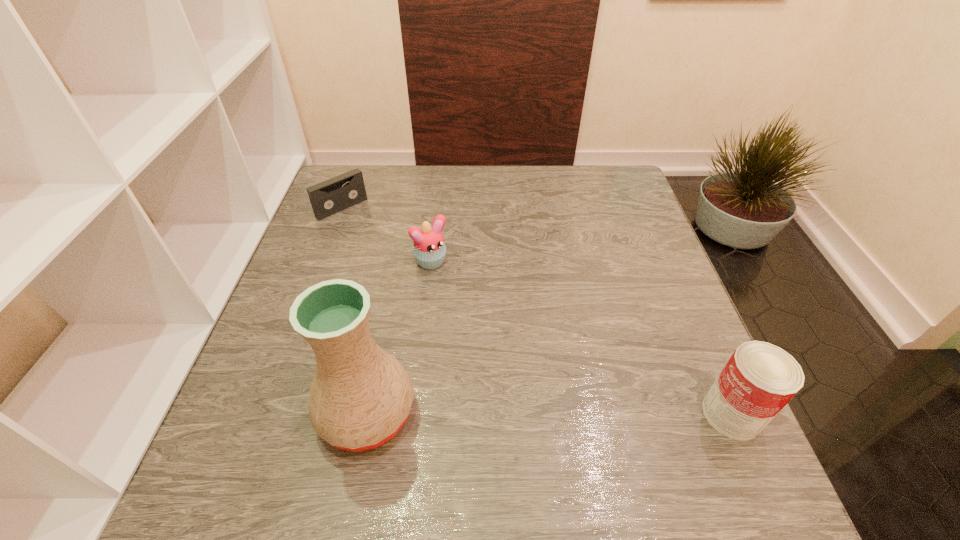
At what (x,y) coordinates should I click in order to perform the action: click on blank space located on the face of the cupcake. Please return your answer as a coordinate pair (x, y). The width and height of the screenshot is (960, 540). Looking at the image, I should click on (529, 367).

You are a GUI agent. You are given a task and a screenshot of the screen. Output one action in this format:
    pyautogui.click(x=<x>, y=<y>)
    Task: Click on the vacant space positioned 0.290m on the front-facing side of the videotape
    This screenshot has width=960, height=540.
    Given the screenshot: What is the action you would take?
    pyautogui.click(x=415, y=273)

This screenshot has height=540, width=960. I want to click on free space located 0.200m on the front-facing side of the videotape, so click(x=394, y=254).

Find the location of a particular element. The width and height of the screenshot is (960, 540). vacant area situated on the front-facing side of the videotape is located at coordinates (443, 299).

At what (x,y) coordinates should I click in order to perform the action: click on object positioned at the far edge. Please return your answer as a coordinate pair (x, y). Looking at the image, I should click on (329, 197).

The height and width of the screenshot is (540, 960). What are the coordinates of `pottery located in the near edge section of the desktop` in the screenshot? It's located at (360, 397).

Find the location of a particular element. The height and width of the screenshot is (540, 960). can that is at the near edge is located at coordinates (759, 379).

In order to click on pottery that is at the left edge in this screenshot , I will do `click(360, 397)`.

Locate an element on the screen. videotape at the left edge is located at coordinates (329, 197).

At what (x,y) coordinates should I click in order to perform the action: click on object located at the right edge. Please return your answer as a coordinate pair (x, y). This screenshot has height=540, width=960. Looking at the image, I should click on (759, 379).